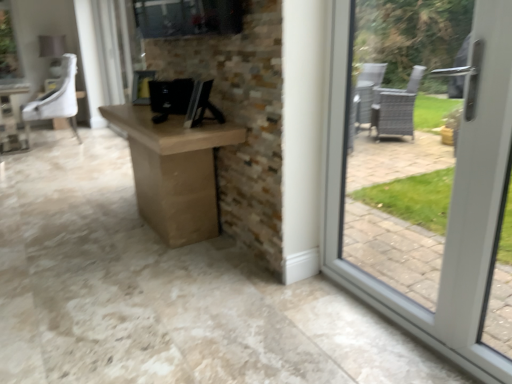
Question: Can you confirm if white leather chair at upper left is smaller than black glossy desktop computer at center?

Choices:
 (A) yes
 (B) no

Answer: (B)

Question: Could you tell me if white leather chair at upper left is facing black glossy desktop computer at center?

Choices:
 (A) no
 (B) yes

Answer: (A)

Question: From a real-world perspective, is white leather chair at upper left physically below black glossy desktop computer at center?

Choices:
 (A) no
 (B) yes

Answer: (B)

Question: Considering the relative positions of white leather chair at upper left and black glossy desktop computer at center in the image provided, is white leather chair at upper left behind black glossy desktop computer at center?

Choices:
 (A) yes
 (B) no

Answer: (A)

Question: Would you say white leather chair at upper left contains black glossy desktop computer at center?

Choices:
 (A) no
 (B) yes

Answer: (A)

Question: Can you confirm if white leather chair at upper left is bigger than black glossy desktop computer at center?

Choices:
 (A) no
 (B) yes

Answer: (B)

Question: From a real-world perspective, is brown cardboard box at center on top of black glossy desktop computer at center?

Choices:
 (A) no
 (B) yes

Answer: (A)

Question: Is brown cardboard box at center at the right side of black glossy desktop computer at center?

Choices:
 (A) no
 (B) yes

Answer: (A)

Question: Is brown cardboard box at center bigger than black glossy desktop computer at center?

Choices:
 (A) yes
 (B) no

Answer: (A)

Question: Is brown cardboard box at center smaller than black glossy desktop computer at center?

Choices:
 (A) no
 (B) yes

Answer: (A)

Question: Is brown cardboard box at center in front of black glossy desktop computer at center?

Choices:
 (A) no
 (B) yes

Answer: (B)

Question: Is brown cardboard box at center further to the viewer compared to black glossy desktop computer at center?

Choices:
 (A) no
 (B) yes

Answer: (A)

Question: Can you confirm if black glossy desktop computer at center is positioned to the left of white leather chair at upper left?

Choices:
 (A) no
 (B) yes

Answer: (A)